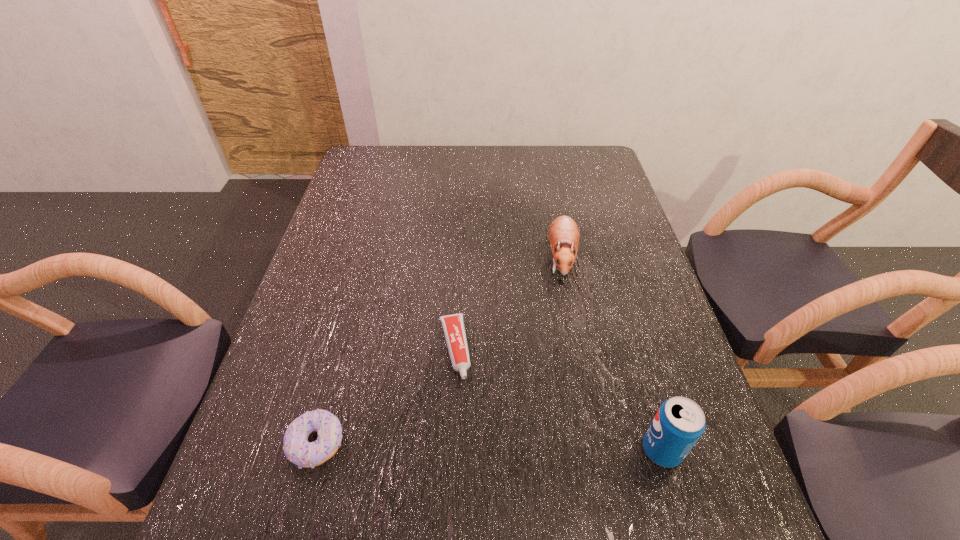
The width and height of the screenshot is (960, 540). Find the location of `the second shortest object`. the second shortest object is located at coordinates (297, 449).

Locate an element on the screen. The height and width of the screenshot is (540, 960). the leftmost object is located at coordinates (297, 449).

In order to click on the rightmost object in this screenshot , I will do `click(679, 423)`.

Where is `soda can`? Image resolution: width=960 pixels, height=540 pixels. soda can is located at coordinates (679, 423).

Where is `the third nearest object`? the third nearest object is located at coordinates (453, 326).

Locate an element on the screen. the shortest object is located at coordinates (453, 326).

The width and height of the screenshot is (960, 540). In order to click on the third shortest object in this screenshot , I will do `click(563, 233)`.

Find the location of a particular element. hamster is located at coordinates (563, 233).

Identify the location of vacant region located on the right of the doughnut. The width and height of the screenshot is (960, 540). (427, 444).

This screenshot has width=960, height=540. In order to click on vacant region located 0.170m on the back of the tallest object in this screenshot , I will do `click(636, 360)`.